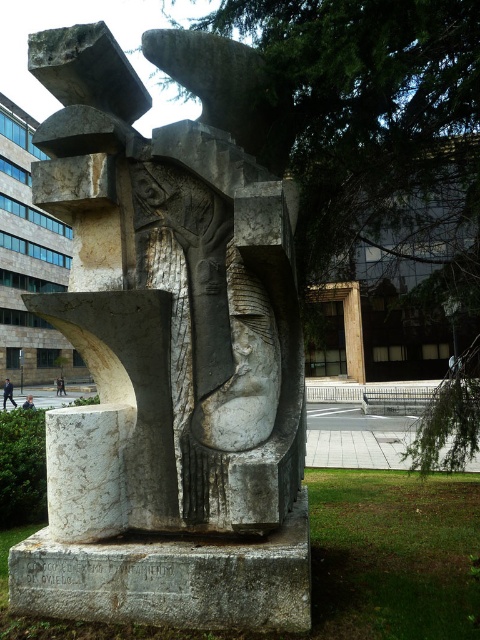
Can you confirm if dark suit at lower left is wider than dark blue jeans at lower left?

Yes, dark suit at lower left is wider than dark blue jeans at lower left.

Describe the element at coordinates (8, 394) in the screenshot. I see `dark suit at lower left` at that location.

Locate an element on the screen. The image size is (480, 640). dark suit at lower left is located at coordinates (8, 394).

Who is more forward, (64, 188) or (12, 397)?

Point (64, 188) is in front.

Locate an element on the screen. The image size is (480, 640). white marble sculpture at center is located at coordinates (165, 310).

From the picture: Is white marble sculpture at center closer to the viewer compared to dark blue jeans at lower left?

Yes.

What are the coordinates of `white marble sculpture at center` in the screenshot? It's located at (165, 310).